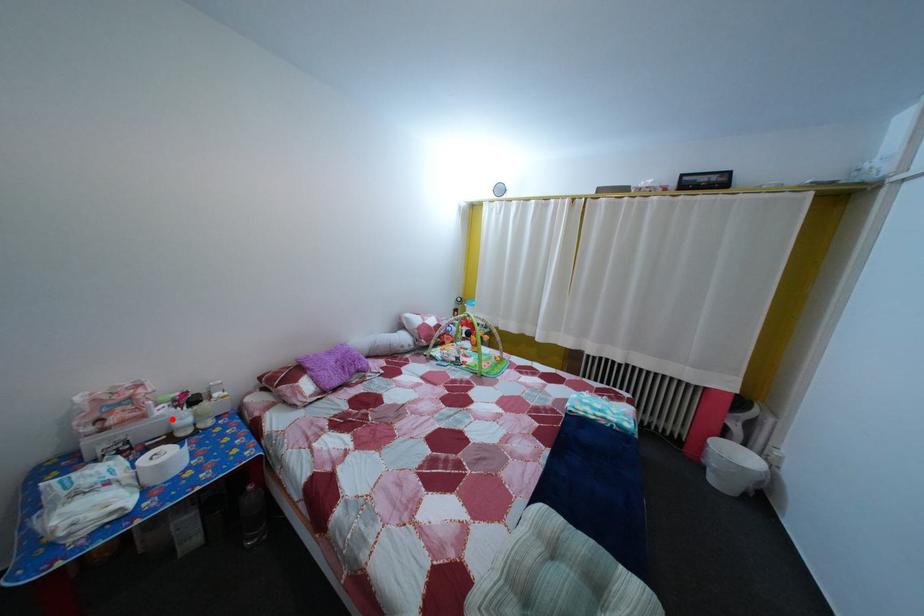
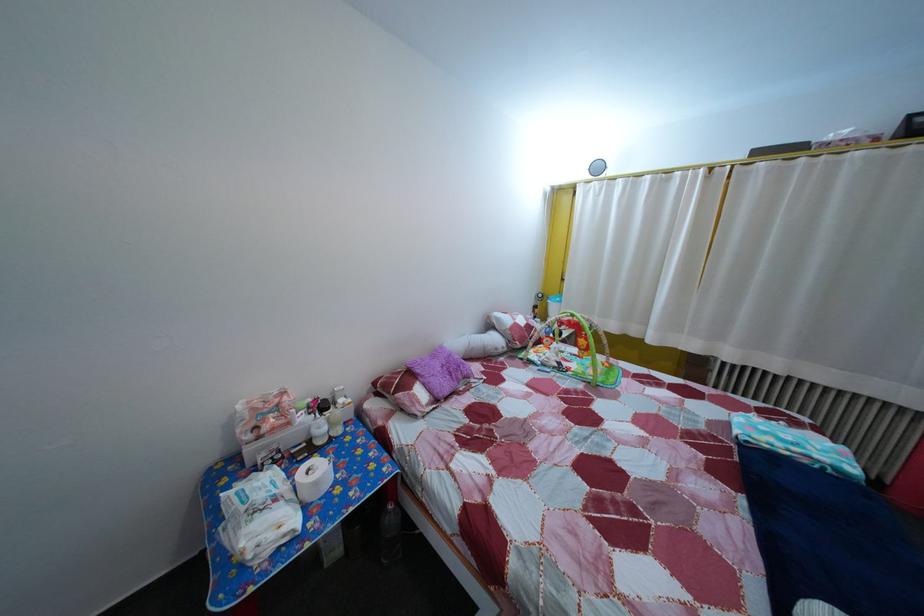
Question: I am providing you with two images of the same scene from different viewpoints. A red point is marked on the first image. At the location where the point appears in image 1, is it still visible in image 2?

Choices:
 (A) Yes
 (B) No

Answer: (A)